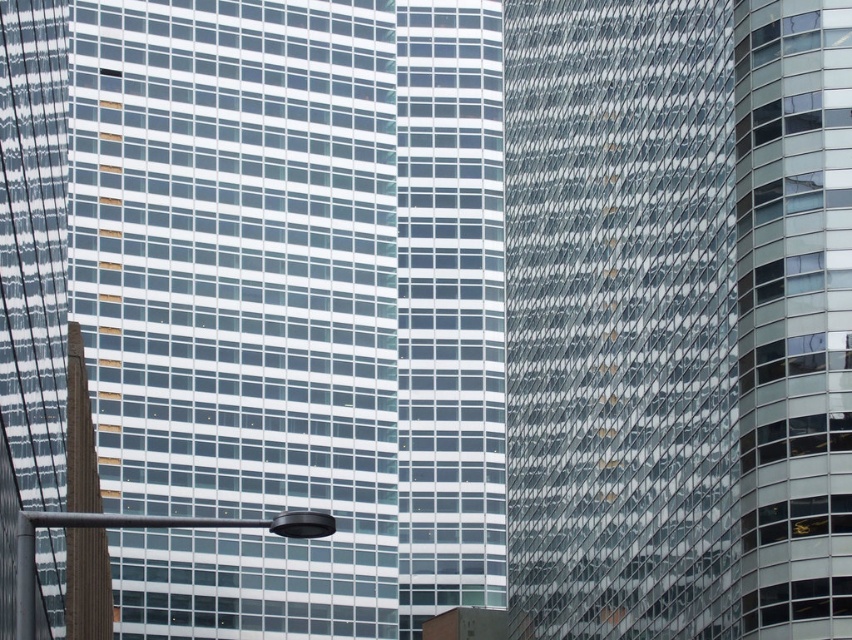
You are a city planner analyzing the layout of the city. You need to determine the exact location of the transparent glass building at center in the image. What are its coordinates?

The transparent glass building at center is located at coordinates point (286, 304).

You are a city planner analyzing the central area of the cityscape. You notice the transparent glass building at center and the glassy reflective skyscraper at center. Which of these two buildings has a greater width?

The transparent glass building at center has a greater width than the glassy reflective skyscraper at center.

You are a city planner analyzing the layout of the city. You notice the transparent glass building at center and the glassy reflective skyscraper at center. Which one is closer to the street level where you are standing?

The transparent glass building at center is closer to the street level where you are standing because it is in front of the glassy reflective skyscraper at center.